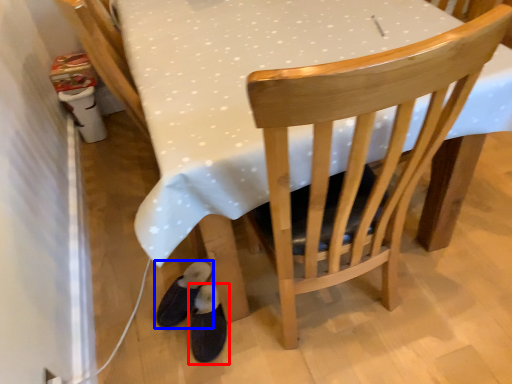
Question: Which object appears closest to the camera in this image, footwear (highlighted by a red box) or footwear (highlighted by a blue box)?

Choices:
 (A) footwear
 (B) footwear

Answer: (A)